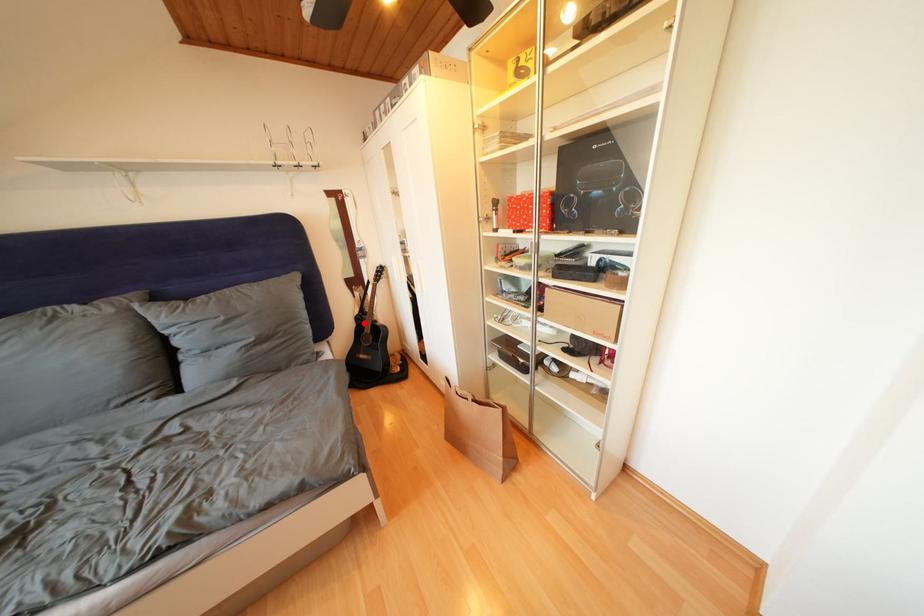
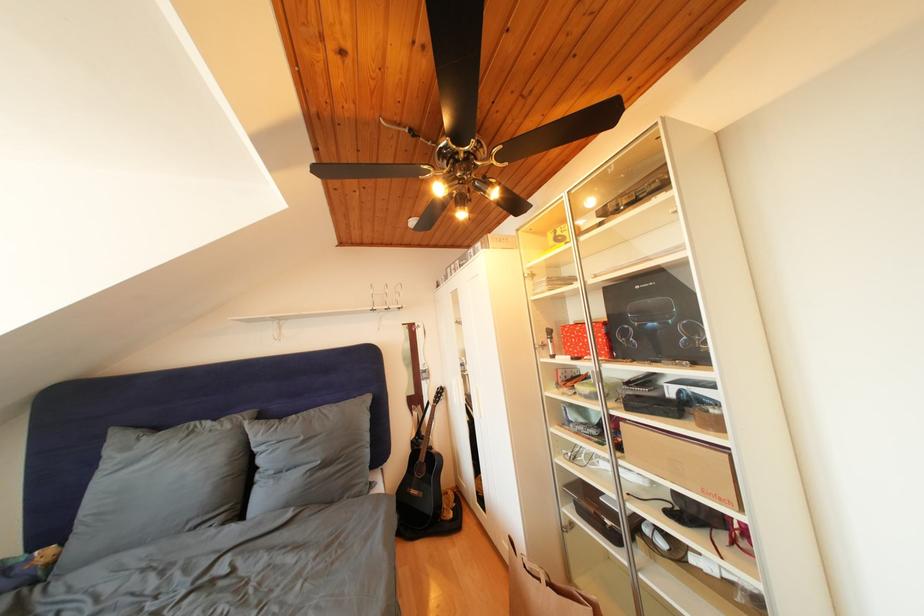
The point at the highlighted location is marked in the first image. Where is the corresponding point in the second image?

(420, 447)